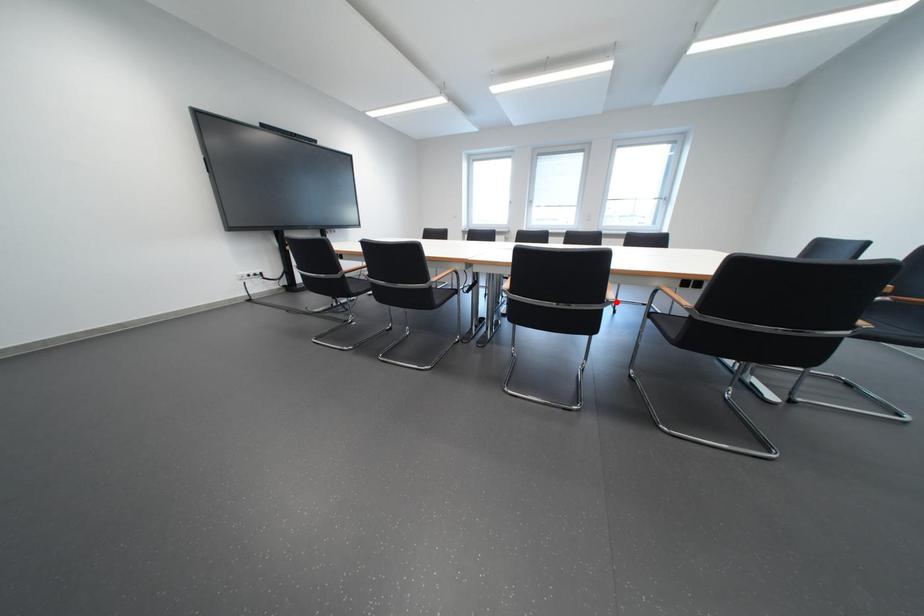
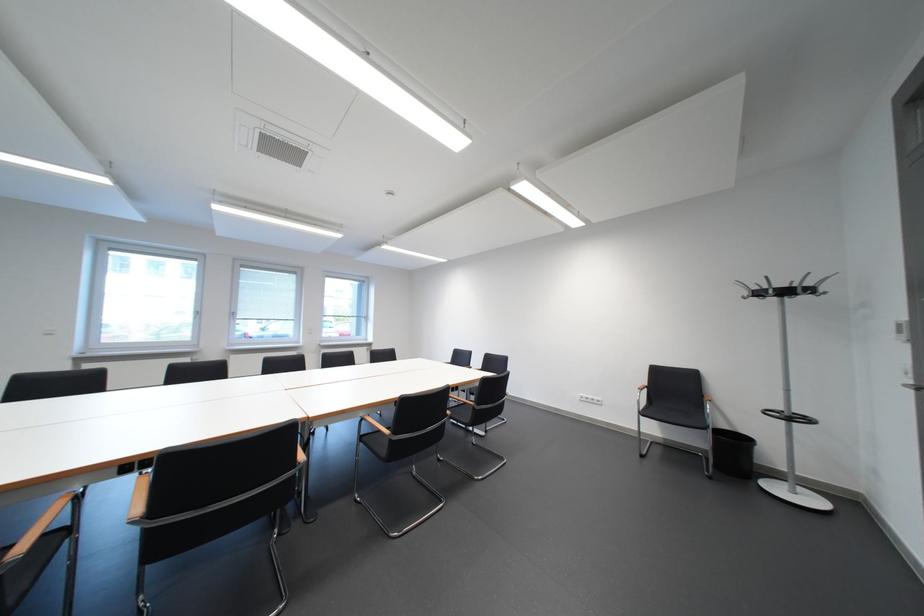
Question: I am providing you with two images of the same scene from different viewpoints. Given a red point in image1, look at the same physical point in image2. Is it:

Choices:
 (A) Closer to the viewpoint
 (B) Farther from the viewpoint

Answer: (A)